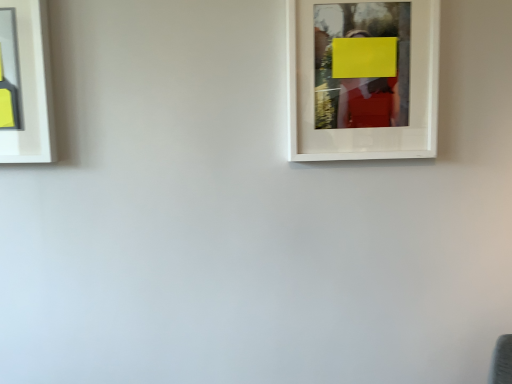
Question: From a real-world perspective, is white matte picture frame at upper right, the 1th picture frame positioned from the right, over matte gray picture frame at left, which ranks as the second picture frame in right-to-left order?

Choices:
 (A) yes
 (B) no

Answer: (B)

Question: Is white matte picture frame at upper right, the 1th picture frame positioned from the right, to the right of matte gray picture frame at left, which ranks as the second picture frame in right-to-left order, from the viewer's perspective?

Choices:
 (A) no
 (B) yes

Answer: (B)

Question: From the image's perspective, would you say white matte picture frame at upper right, the 1th picture frame positioned from the right, is shown under matte gray picture frame at left, placed as the first picture frame when sorted from left to right?

Choices:
 (A) yes
 (B) no

Answer: (B)

Question: Considering the relative sizes of white matte picture frame at upper right, placed as the 2th picture frame when sorted from left to right, and matte gray picture frame at left, which ranks as the second picture frame in right-to-left order, in the image provided, is white matte picture frame at upper right, placed as the 2th picture frame when sorted from left to right, taller than matte gray picture frame at left, which ranks as the second picture frame in right-to-left order,?

Choices:
 (A) no
 (B) yes

Answer: (B)

Question: Does white matte picture frame at upper right, the 1th picture frame positioned from the right, have a larger size compared to matte gray picture frame at left, placed as the first picture frame when sorted from left to right?

Choices:
 (A) yes
 (B) no

Answer: (A)

Question: Is white matte picture frame at upper right, the 1th picture frame positioned from the right, further to camera compared to matte gray picture frame at left, which ranks as the second picture frame in right-to-left order?

Choices:
 (A) no
 (B) yes

Answer: (A)

Question: From the image's perspective, is matte gray picture frame at left, which ranks as the second picture frame in right-to-left order, above white matte picture frame at upper right, the 1th picture frame positioned from the right?

Choices:
 (A) yes
 (B) no

Answer: (B)

Question: Is matte gray picture frame at left, placed as the first picture frame when sorted from left to right, further to the viewer compared to white matte picture frame at upper right, the 1th picture frame positioned from the right?

Choices:
 (A) yes
 (B) no

Answer: (A)

Question: Is matte gray picture frame at left, which ranks as the second picture frame in right-to-left order, beside white matte picture frame at upper right, the 1th picture frame positioned from the right?

Choices:
 (A) yes
 (B) no

Answer: (B)

Question: Can white matte picture frame at upper right, placed as the 2th picture frame when sorted from left to right, be found inside matte gray picture frame at left, which ranks as the second picture frame in right-to-left order?

Choices:
 (A) no
 (B) yes

Answer: (A)

Question: Can you confirm if matte gray picture frame at left, which ranks as the second picture frame in right-to-left order, is shorter than white matte picture frame at upper right, placed as the 2th picture frame when sorted from left to right?

Choices:
 (A) no
 (B) yes

Answer: (B)

Question: From a real-world perspective, is matte gray picture frame at left, which ranks as the second picture frame in right-to-left order, located beneath white matte picture frame at upper right, the 1th picture frame positioned from the right?

Choices:
 (A) no
 (B) yes

Answer: (A)

Question: Is point (411, 114) positioned closer to the camera than point (31, 49)?

Choices:
 (A) farther
 (B) closer

Answer: (A)